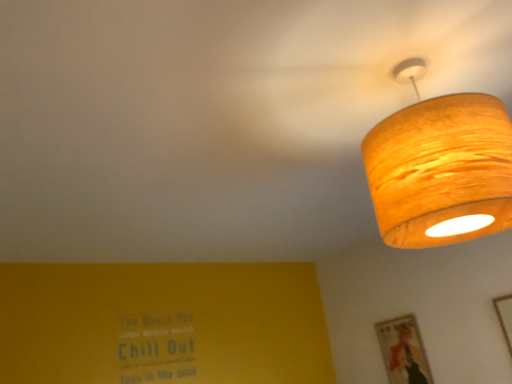
Question: From the image's perspective, is wooden textured picture frame at lower right, placed as the 1th picture frame when sorted from left to right, located above wooden picture frame at upper right, which ranks as the 1th picture frame in front-to-back order?

Choices:
 (A) no
 (B) yes

Answer: (A)

Question: Is wooden textured picture frame at lower right, the second picture frame from the right, far away from wooden picture frame at upper right, the first picture frame viewed from the right?

Choices:
 (A) no
 (B) yes

Answer: (A)

Question: Is wooden textured picture frame at lower right, marked as the first picture frame in a back-to-front arrangement, taller than wooden picture frame at upper right, which ranks as the 1th picture frame in front-to-back order?

Choices:
 (A) yes
 (B) no

Answer: (B)

Question: Is wooden textured picture frame at lower right, positioned as the second picture frame in front-to-back order, directly adjacent to wooden picture frame at upper right, the first picture frame viewed from the right?

Choices:
 (A) no
 (B) yes

Answer: (A)

Question: Is wooden textured picture frame at lower right, placed as the 1th picture frame when sorted from left to right, positioned beyond the bounds of wooden picture frame at upper right, which is the 2th picture frame in back-to-front order?

Choices:
 (A) no
 (B) yes

Answer: (B)

Question: Is wooden textured picture frame at lower right, marked as the first picture frame in a back-to-front arrangement, in front of or behind wooden picture frame at upper right, which ranks as the 1th picture frame in front-to-back order, in the image?

Choices:
 (A) behind
 (B) front

Answer: (A)

Question: From a real-world perspective, is wooden textured picture frame at lower right, the second picture frame from the right, positioned above or below wooden picture frame at upper right, which ranks as the 1th picture frame in front-to-back order?

Choices:
 (A) below
 (B) above

Answer: (B)

Question: From the image's perspective, is wooden textured picture frame at lower right, the second picture frame from the right, positioned above or below wooden picture frame at upper right, which ranks as the 1th picture frame in front-to-back order?

Choices:
 (A) below
 (B) above

Answer: (A)

Question: Looking at the image, does wooden textured picture frame at lower right, positioned as the second picture frame in front-to-back order, seem bigger or smaller compared to wooden picture frame at upper right, which is the 2th picture frame in back-to-front order?

Choices:
 (A) big
 (B) small

Answer: (A)

Question: Considering their positions, is wooden picture frame at upper right, which ranks as the 1th picture frame in front-to-back order, located in front of or behind wooden textured lampshade at upper right?

Choices:
 (A) behind
 (B) front

Answer: (A)

Question: In terms of size, does wooden picture frame at upper right, which is the 2th picture frame in back-to-front order, appear bigger or smaller than wooden textured lampshade at upper right?

Choices:
 (A) big
 (B) small

Answer: (B)

Question: From their relative heights in the image, would you say wooden picture frame at upper right, which ranks as the 1th picture frame in front-to-back order, is taller or shorter than wooden textured lampshade at upper right?

Choices:
 (A) tall
 (B) short

Answer: (B)

Question: Is wooden picture frame at upper right, which ranks as the 1th picture frame in front-to-back order, inside the boundaries of wooden textured lampshade at upper right, or outside?

Choices:
 (A) inside
 (B) outside

Answer: (B)

Question: Is wooden picture frame at upper right, arranged as the 2th picture frame when viewed from the left, inside the boundaries of wooden textured picture frame at lower right, positioned as the second picture frame in front-to-back order, or outside?

Choices:
 (A) inside
 (B) outside

Answer: (B)

Question: From the image's perspective, relative to wooden textured picture frame at lower right, placed as the 1th picture frame when sorted from left to right, is wooden picture frame at upper right, the first picture frame viewed from the right, above or below?

Choices:
 (A) above
 (B) below

Answer: (A)